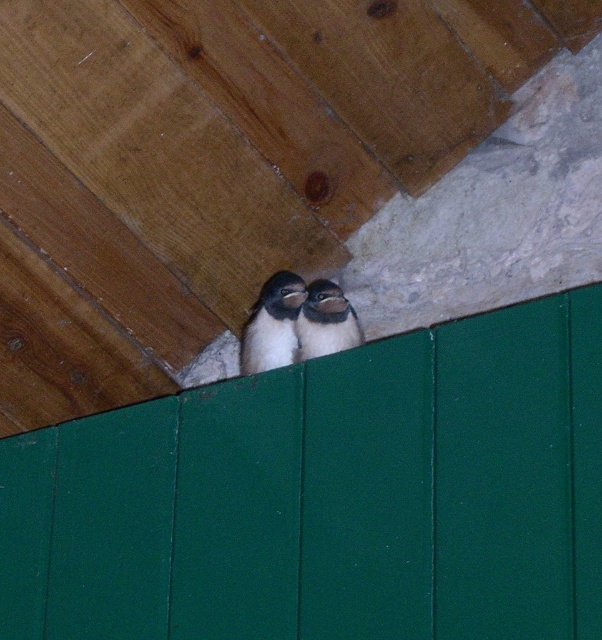
Who is more forward, (281, 362) or (356, 330)?

Point (281, 362) is in front.

Does white downy penguin at center have a greater height compared to white matte penguin at center?

Yes, white downy penguin at center is taller than white matte penguin at center.

The height and width of the screenshot is (640, 602). I want to click on white downy penguin at center, so click(272, 324).